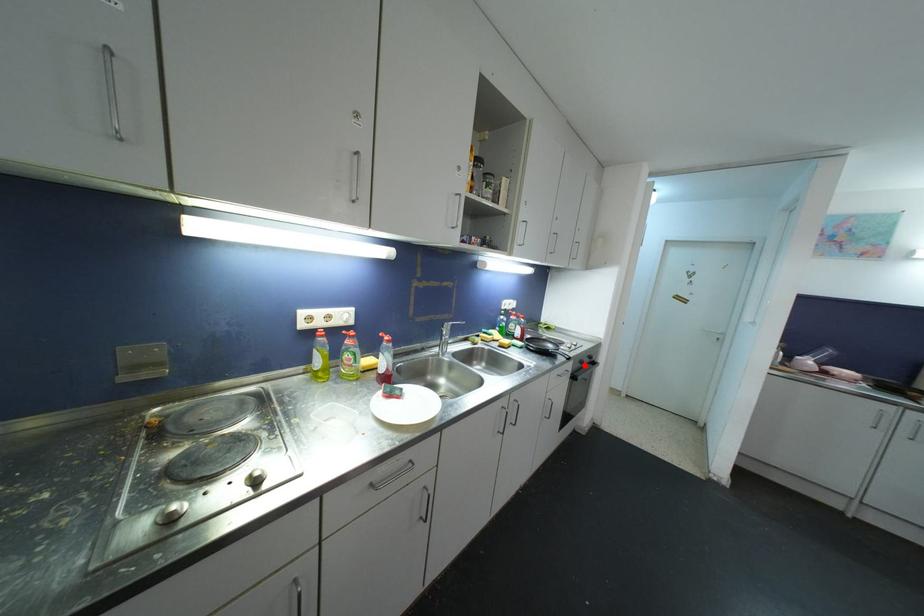
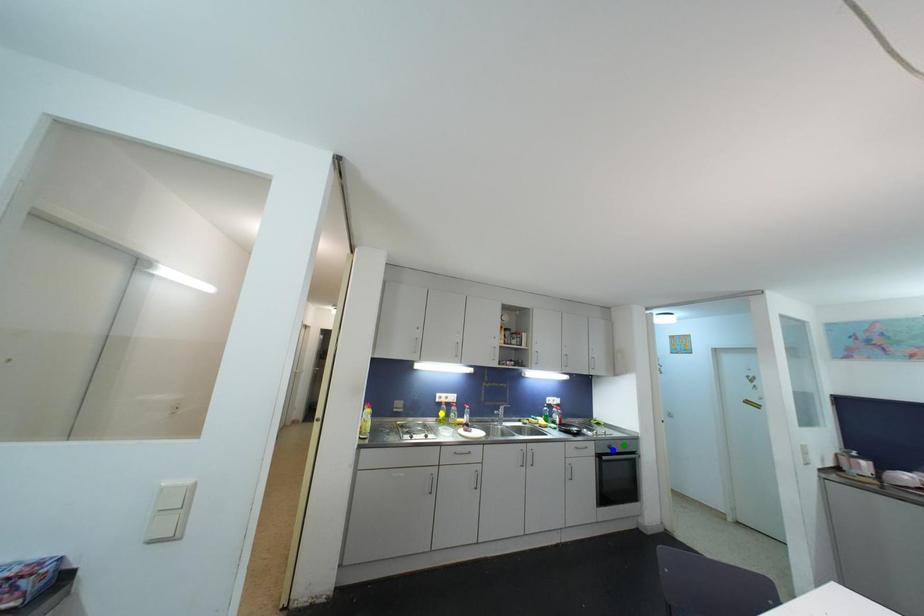
Question: I am providing you with two images of the same scene from different viewpoints. A red point is marked on the first image. You are given multiple points on the second image. Which mark in image 2 goes with the point in image 1?

Choices:
 (A) green point
 (B) blue point
 (C) yellow point

Answer: (B)